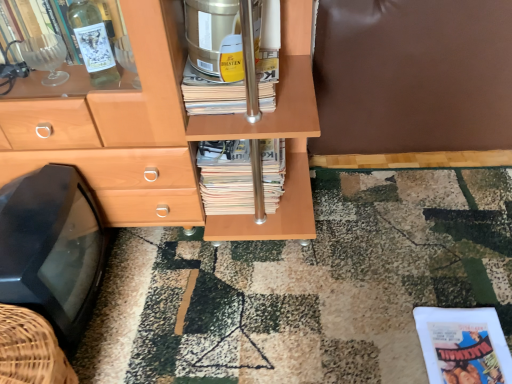
Question: Does matte white paperback book at lower right have a lesser height compared to stacked paper magazine at center?

Choices:
 (A) no
 (B) yes

Answer: (B)

Question: Is matte white paperback book at lower right placed right next to stacked paper magazine at center?

Choices:
 (A) no
 (B) yes

Answer: (A)

Question: From a real-world perspective, is matte white paperback book at lower right positioned under stacked paper magazine at center based on gravity?

Choices:
 (A) no
 (B) yes

Answer: (B)

Question: Does matte white paperback book at lower right have a greater height compared to stacked paper magazine at center?

Choices:
 (A) yes
 (B) no

Answer: (B)

Question: Is matte white paperback book at lower right positioned with its back to stacked paper magazine at center?

Choices:
 (A) yes
 (B) no

Answer: (B)

Question: Is gold metallic canister at center to the left or to the right of black plastic tv at lower left in the image?

Choices:
 (A) left
 (B) right

Answer: (B)

Question: Is gold metallic canister at center in front of or behind black plastic tv at lower left in the image?

Choices:
 (A) behind
 (B) front

Answer: (A)

Question: Considering the positions of gold metallic canister at center and black plastic tv at lower left in the image, is gold metallic canister at center taller or shorter than black plastic tv at lower left?

Choices:
 (A) tall
 (B) short

Answer: (B)

Question: Is point (274, 87) positioned closer to the camera than point (2, 216)?

Choices:
 (A) closer
 (B) farther

Answer: (B)

Question: Relative to stacked paper magazine at center, is gold metallic canister at center in front or behind?

Choices:
 (A) behind
 (B) front

Answer: (B)

Question: Is gold metallic canister at center to the left or to the right of stacked paper magazine at center in the image?

Choices:
 (A) left
 (B) right

Answer: (A)

Question: From their relative heights in the image, would you say gold metallic canister at center is taller or shorter than stacked paper magazine at center?

Choices:
 (A) short
 (B) tall

Answer: (A)

Question: From a real-world perspective, is gold metallic canister at center above or below stacked paper magazine at center?

Choices:
 (A) above
 (B) below

Answer: (A)

Question: From their relative heights in the image, would you say stacked paper magazine at center is taller or shorter than gold metallic canister at center?

Choices:
 (A) short
 (B) tall

Answer: (B)

Question: From the image's perspective, is stacked paper magazine at center located above or below gold metallic canister at center?

Choices:
 (A) above
 (B) below

Answer: (B)